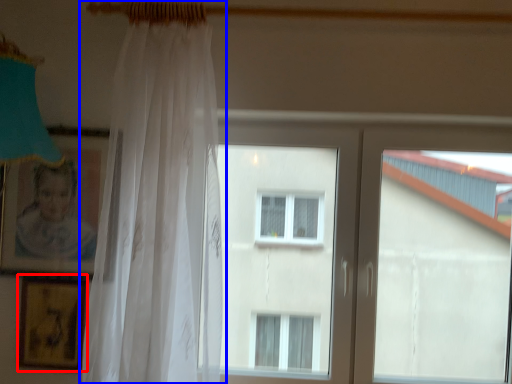
Question: Which of the following is the farthest to the observer, picture frame (highlighted by a red box) or curtain (highlighted by a blue box)?

Choices:
 (A) picture frame
 (B) curtain

Answer: (A)